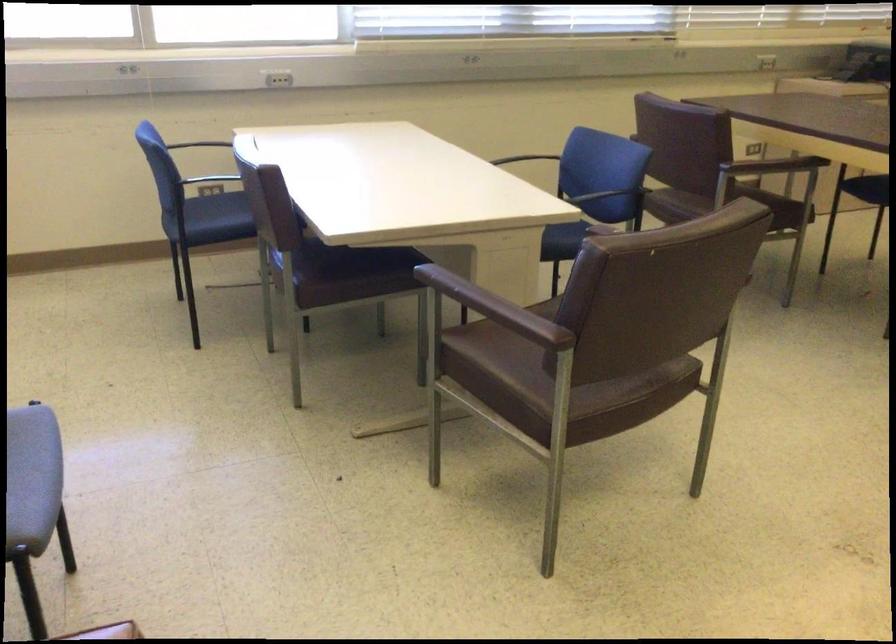
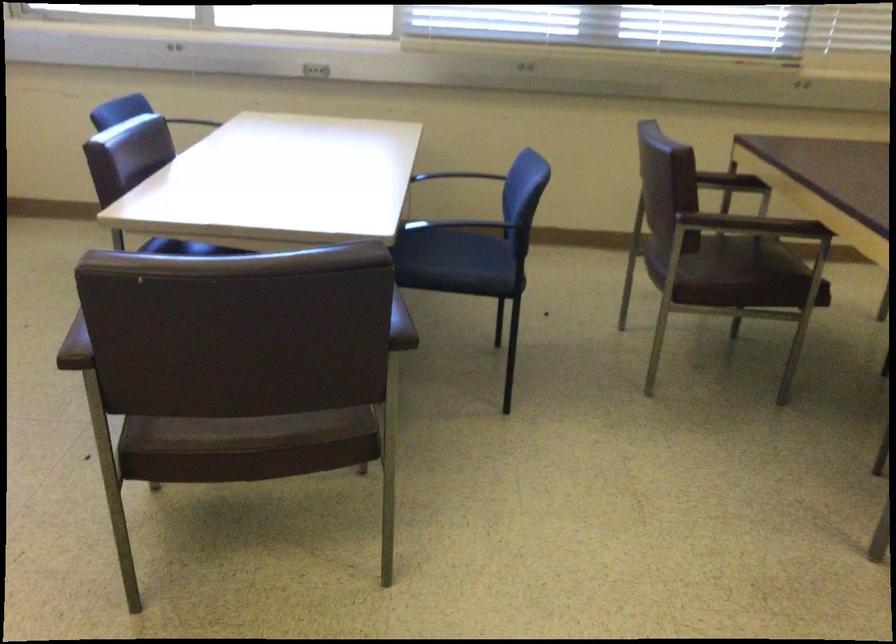
Question: I am providing you with two images of the same scene from different viewpoints. Please identify which objects are invisible in image2.

Choices:
 (A) brown chair sitting surface
 (B) blue chair sitting surface
 (C) red top spray bottle
 (D) brown chair armrest

Answer: (B)